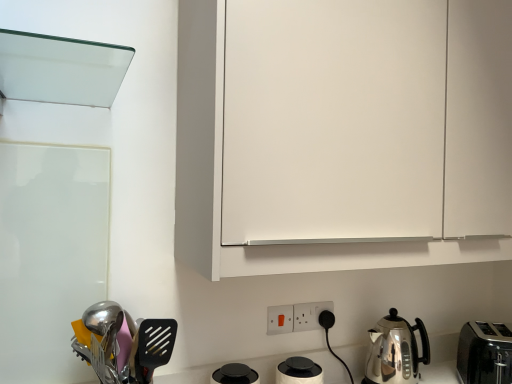
Question: Is satin silver kettle at lower right facing towards white matte cabinet at upper center?

Choices:
 (A) yes
 (B) no

Answer: (B)

Question: Considering the relative sizes of satin silver kettle at lower right and white matte cabinet at upper center in the image provided, is satin silver kettle at lower right thinner than white matte cabinet at upper center?

Choices:
 (A) yes
 (B) no

Answer: (A)

Question: From the image's perspective, is satin silver kettle at lower right on top of white matte cabinet at upper center?

Choices:
 (A) no
 (B) yes

Answer: (A)

Question: From a real-world perspective, is satin silver kettle at lower right beneath white matte cabinet at upper center?

Choices:
 (A) yes
 (B) no

Answer: (A)

Question: From the image's perspective, is satin silver kettle at lower right beneath white matte cabinet at upper center?

Choices:
 (A) no
 (B) yes

Answer: (B)

Question: In terms of size, does white plastic electric outlet at lower center, positioned as the second electric outlet in front-to-back order, appear bigger or smaller than polished stainless steel utensils at lower left?

Choices:
 (A) big
 (B) small

Answer: (B)

Question: From their relative heights in the image, would you say white plastic electric outlet at lower center, positioned as the second electric outlet in front-to-back order, is taller or shorter than polished stainless steel utensils at lower left?

Choices:
 (A) tall
 (B) short

Answer: (B)

Question: Considering the positions of point (331, 304) and point (96, 322), is point (331, 304) closer or farther from the camera than point (96, 322)?

Choices:
 (A) farther
 (B) closer

Answer: (A)

Question: From the image's perspective, is white plastic electric outlet at lower center, the first electric outlet when ordered from right to left, located above or below polished stainless steel utensils at lower left?

Choices:
 (A) above
 (B) below

Answer: (B)

Question: Which is correct: white plastic electric outlet at lower center, the second electric outlet viewed from the left, is inside white matte cabinet at upper center, or outside of it?

Choices:
 (A) inside
 (B) outside

Answer: (B)

Question: Considering the positions of white plastic electric outlet at lower center, the second electric outlet viewed from the left, and white matte cabinet at upper center in the image, is white plastic electric outlet at lower center, the second electric outlet viewed from the left, taller or shorter than white matte cabinet at upper center?

Choices:
 (A) tall
 (B) short

Answer: (B)

Question: From a real-world perspective, is white plastic electric outlet at lower center, positioned as the second electric outlet in front-to-back order, above or below white matte cabinet at upper center?

Choices:
 (A) above
 (B) below

Answer: (B)

Question: Relative to white matte cabinet at upper center, is white plastic electric outlet at lower center, positioned as the second electric outlet in front-to-back order, in front or behind?

Choices:
 (A) behind
 (B) front

Answer: (A)

Question: Is satin silver kettle at lower right taller or shorter than polished stainless steel utensils at lower left?

Choices:
 (A) tall
 (B) short

Answer: (A)

Question: Is satin silver kettle at lower right spatially inside polished stainless steel utensils at lower left, or outside of it?

Choices:
 (A) outside
 (B) inside

Answer: (A)